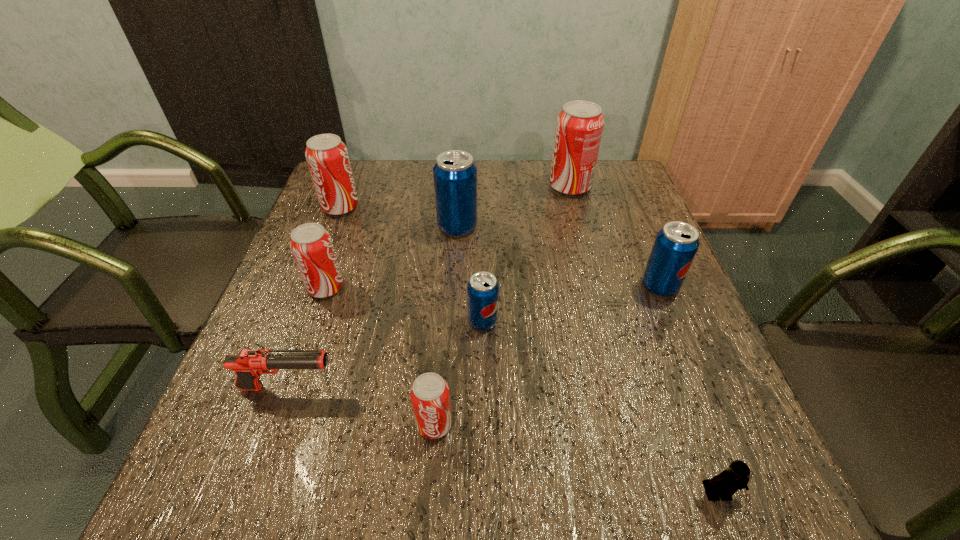
Find the location of a particular element. Image resolution: width=960 pixels, height=540 pixels. object at the near right corner is located at coordinates (726, 484).

In the image, there is a desktop. Where is `vacant space at the far edge`? vacant space at the far edge is located at coordinates tap(420, 184).

What are the coordinates of `free spot at the near edge of the desktop` in the screenshot? It's located at (591, 502).

Locate an element on the screen. Image resolution: width=960 pixels, height=540 pixels. vacant region at the left edge of the desktop is located at coordinates (209, 437).

You are a GUI agent. You are given a task and a screenshot of the screen. Output one action in this format:
    pyautogui.click(x=<x>, y=<y>)
    Task: Click on the free space at the right edge of the desktop
    The width and height of the screenshot is (960, 540).
    Given the screenshot: What is the action you would take?
    pyautogui.click(x=626, y=210)

Locate an element on the screen. The height and width of the screenshot is (540, 960). free region at the far left corner of the desktop is located at coordinates (375, 167).

At what (x,y) coordinates should I click in order to perform the action: click on free spot at the near left corner of the desktop. Please return your answer as a coordinate pair (x, y). This screenshot has width=960, height=540. Looking at the image, I should click on (240, 460).

The image size is (960, 540). I want to click on free space between the third red soda can from left to right and the third biggest red soda can, so click(x=380, y=356).

Locate an element on the screen. vacant area that lies between the second farthest blue pop soda and the smallest red soda can is located at coordinates (547, 355).

Find the location of a particular element. The image size is (960, 540). empty location between the second biggest red soda can and the Lego is located at coordinates (529, 350).